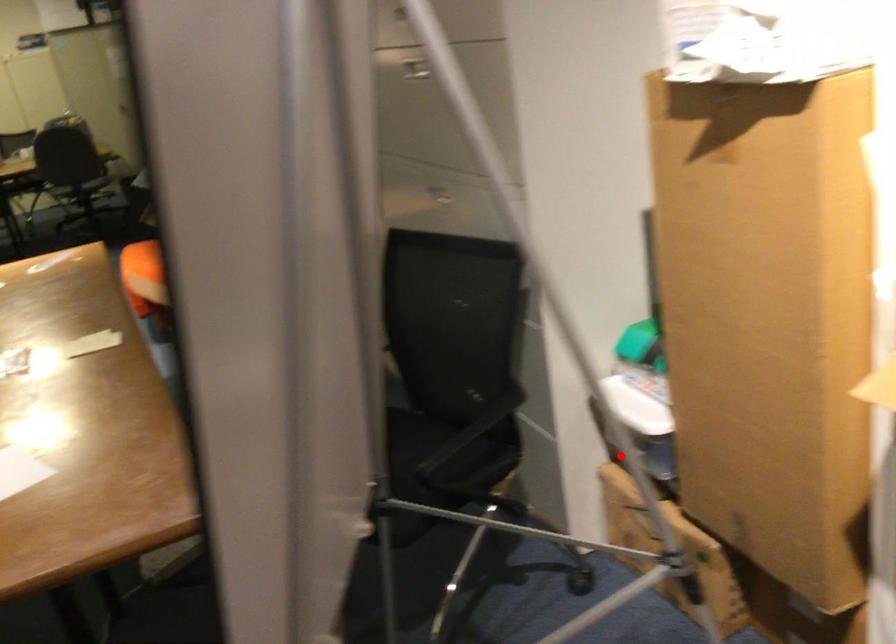
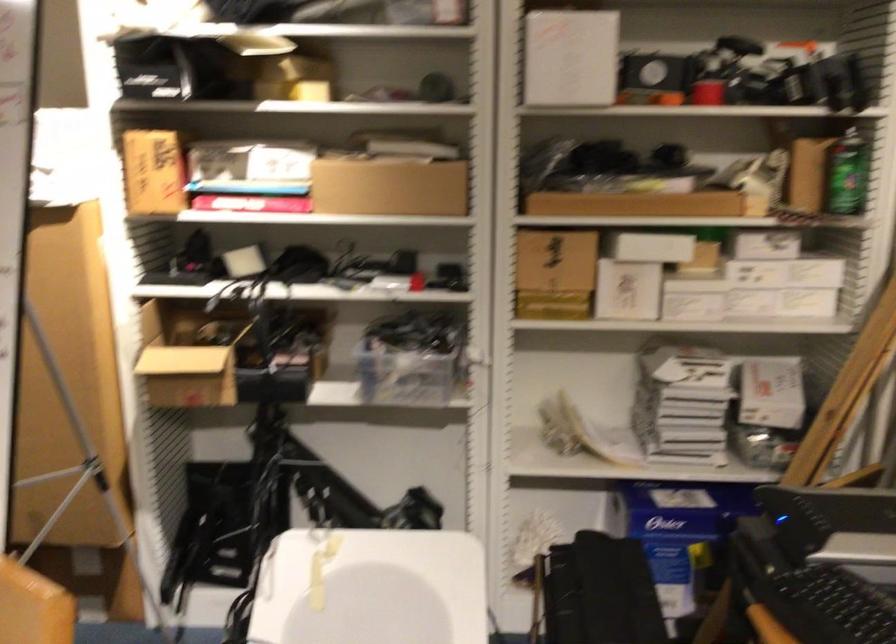
Question: I am providing you with two images of the same scene from different viewpoints. Given a red point in image1, look at the same physical point in image2. Is it:

Choices:
 (A) Closer to the viewpoint
 (B) Farther from the viewpoint

Answer: (B)